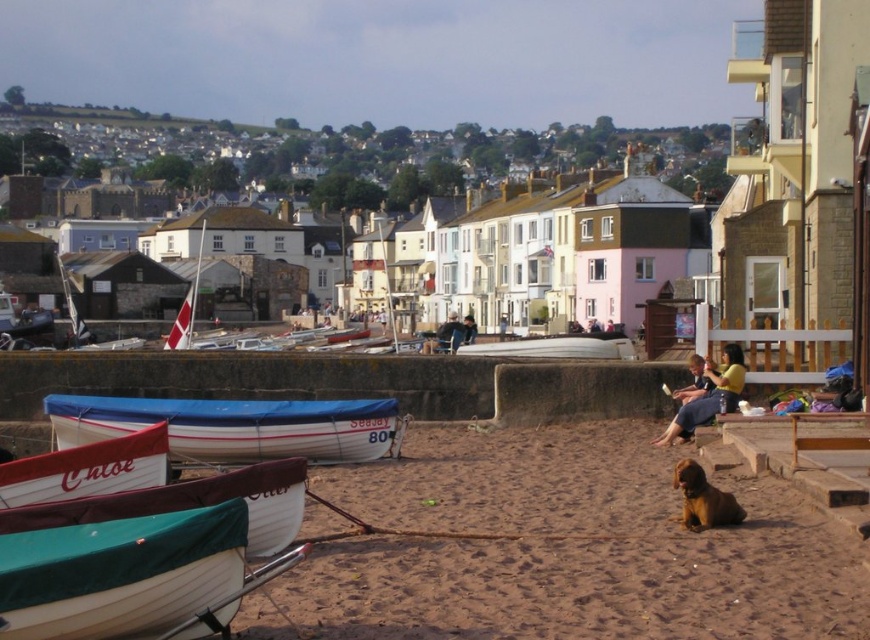
Based on the photo, which is below, yellow cotton shirt at center or white matte boat at center?

yellow cotton shirt at center is below.

Can you confirm if yellow cotton shirt at center is positioned below white matte boat at center?

Indeed, yellow cotton shirt at center is positioned under white matte boat at center.

Describe the element at coordinates (708, 396) in the screenshot. I see `yellow cotton shirt at center` at that location.

Locate an element on the screen. yellow cotton shirt at center is located at coordinates (708, 396).

What do you see at coordinates (703, 499) in the screenshot? I see `brown furry dog at lower right` at bounding box center [703, 499].

Which of these two, brown furry dog at lower right or smooth brown dog at lower right, stands taller?

smooth brown dog at lower right

The width and height of the screenshot is (870, 640). Find the location of `brown furry dog at lower right`. brown furry dog at lower right is located at coordinates (703, 499).

Locate an element on the screen. The image size is (870, 640). brown furry dog at lower right is located at coordinates tap(703, 499).

Which is in front, point (333, 420) or point (142, 436)?

Positioned in front is point (142, 436).

Is white striped tarpaulin boat at lower left thinner than white canvas boat at lower left?

No.

Where is `white striped tarpaulin boat at lower left`? white striped tarpaulin boat at lower left is located at coordinates (235, 426).

Find the location of `white striped tarpaulin boat at lower left`. white striped tarpaulin boat at lower left is located at coordinates (235, 426).